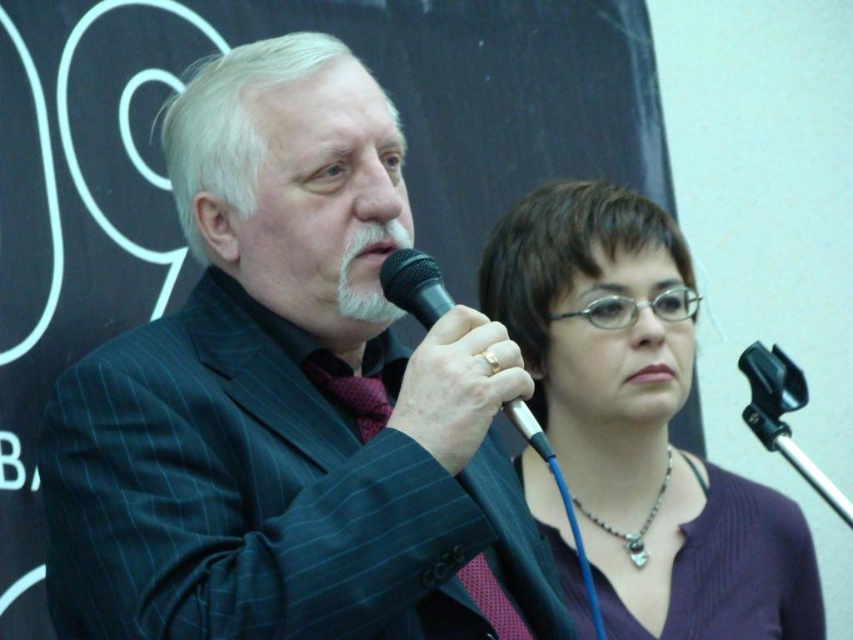
From the picture: Can you confirm if black pinstripe suit at center is positioned above black plastic microphone at center?

Indeed, black pinstripe suit at center is positioned over black plastic microphone at center.

Is black pinstripe suit at center smaller than black plastic microphone at center?

No, black pinstripe suit at center is not smaller than black plastic microphone at center.

Does point (502, 545) lie in front of point (525, 410)?

No, it is not.

Locate an element on the screen. black pinstripe suit at center is located at coordinates 289,401.

Describe the element at coordinates (289, 401) in the screenshot. Image resolution: width=853 pixels, height=640 pixels. I see `black pinstripe suit at center` at that location.

Does black pinstripe suit at center have a smaller size compared to purple knitwear at center?

No, black pinstripe suit at center is not smaller than purple knitwear at center.

Who is more forward, (x=86, y=557) or (x=627, y=445)?

Point (x=86, y=557) is more forward.

Where is `black pinstripe suit at center`? black pinstripe suit at center is located at coordinates (289, 401).

Is purple knitwear at center below black plastic microphone at center?

Indeed, purple knitwear at center is positioned under black plastic microphone at center.

Locate an element on the screen. The image size is (853, 640). purple knitwear at center is located at coordinates (640, 422).

Find the location of `purple knitwear at center`. purple knitwear at center is located at coordinates (640, 422).

Where is `purple knitwear at center`? The width and height of the screenshot is (853, 640). purple knitwear at center is located at coordinates click(x=640, y=422).